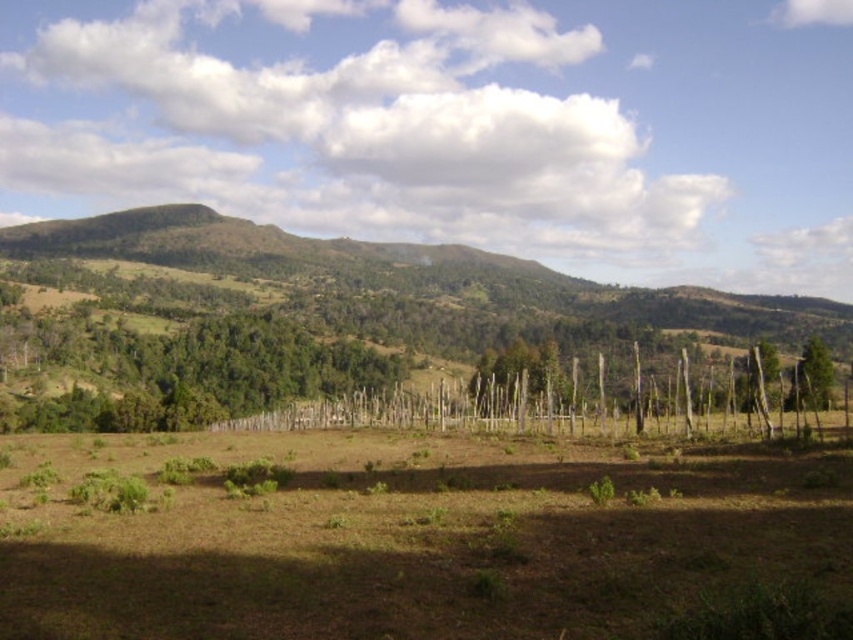
You are a hiker who wants to cross the brown grassy field at center but notices the green rough bark tree at right. Which object is taller?

The green rough bark tree at right is taller than the brown grassy field at center.